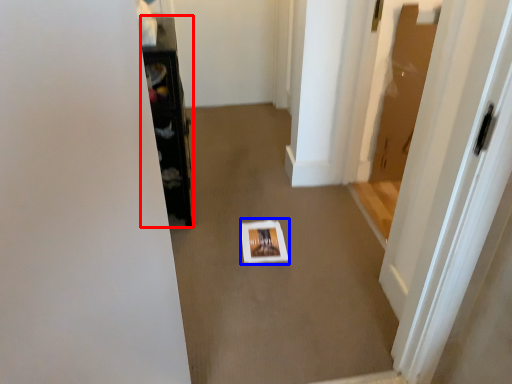
Question: Which object is further to the camera taking this photo, furniture (highlighted by a red box) or square (highlighted by a blue box)?

Choices:
 (A) furniture
 (B) square

Answer: (B)